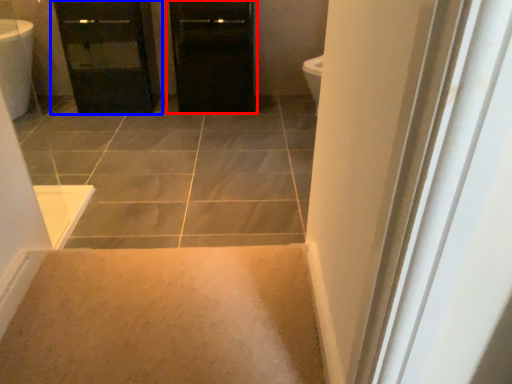
Question: Which of the following is the closest to the observer, door (highlighted by a red box) or bathroom cabinet (highlighted by a blue box)?

Choices:
 (A) door
 (B) bathroom cabinet

Answer: (B)